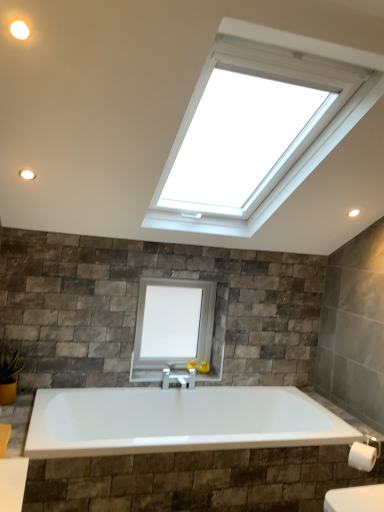
Question: Is white matte light fixture at upper left thinner than white matte window at center?

Choices:
 (A) yes
 (B) no

Answer: (A)

Question: Is white matte light fixture at upper left at the right side of white matte window at center?

Choices:
 (A) yes
 (B) no

Answer: (B)

Question: Is the position of white matte light fixture at upper left less distant than that of white matte window at center?

Choices:
 (A) yes
 (B) no

Answer: (A)

Question: Does white matte light fixture at upper left have a lesser height compared to white matte window at center?

Choices:
 (A) no
 (B) yes

Answer: (B)

Question: Is white matte light fixture at upper left smaller than white matte window at center?

Choices:
 (A) yes
 (B) no

Answer: (A)

Question: Considering the positions of matte white light fixture at upper left and green glossy plant at lower left in the image, is matte white light fixture at upper left taller or shorter than green glossy plant at lower left?

Choices:
 (A) short
 (B) tall

Answer: (A)

Question: Looking at their shapes, would you say matte white light fixture at upper left is wider or thinner than green glossy plant at lower left?

Choices:
 (A) thin
 (B) wide

Answer: (A)

Question: Is point (21, 177) closer or farther from the camera than point (1, 366)?

Choices:
 (A) farther
 (B) closer

Answer: (B)

Question: Based on their sizes in the image, would you say matte white light fixture at upper left is bigger or smaller than green glossy plant at lower left?

Choices:
 (A) big
 (B) small

Answer: (B)

Question: Is white matte light fixture at upper left taller or shorter than matte white light fixture at upper left?

Choices:
 (A) tall
 (B) short

Answer: (B)

Question: Would you say white matte light fixture at upper left is to the left or to the right of matte white light fixture at upper left in the picture?

Choices:
 (A) right
 (B) left

Answer: (A)

Question: From the image's perspective, is white matte light fixture at upper left located above or below matte white light fixture at upper left?

Choices:
 (A) below
 (B) above

Answer: (B)

Question: From a real-world perspective, is white matte light fixture at upper left positioned above or below matte white light fixture at upper left?

Choices:
 (A) below
 (B) above

Answer: (B)

Question: Is point (23, 26) closer or farther from the camera than point (360, 467)?

Choices:
 (A) farther
 (B) closer

Answer: (B)

Question: Is white matte light fixture at upper left inside the boundaries of white matte toilet paper at lower right, or outside?

Choices:
 (A) inside
 (B) outside

Answer: (B)